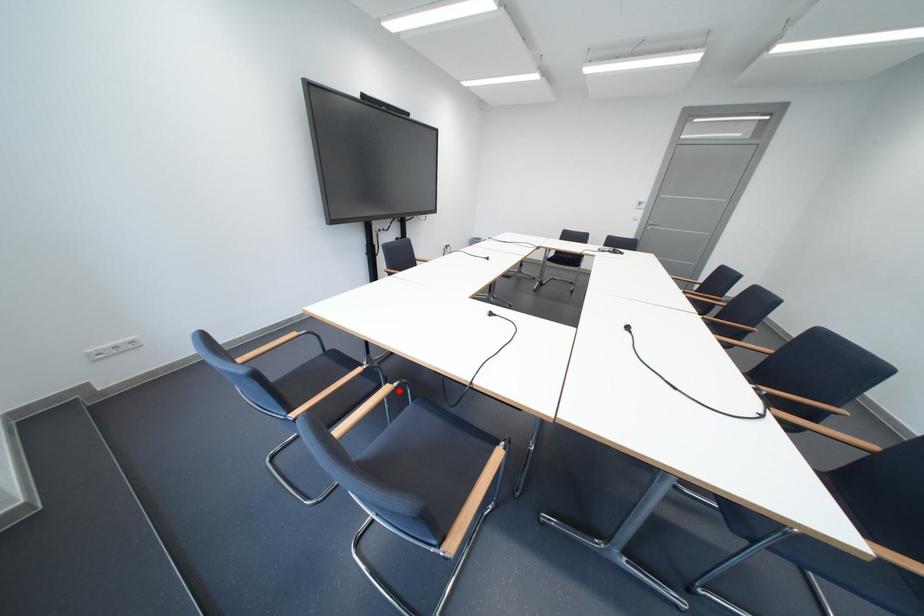
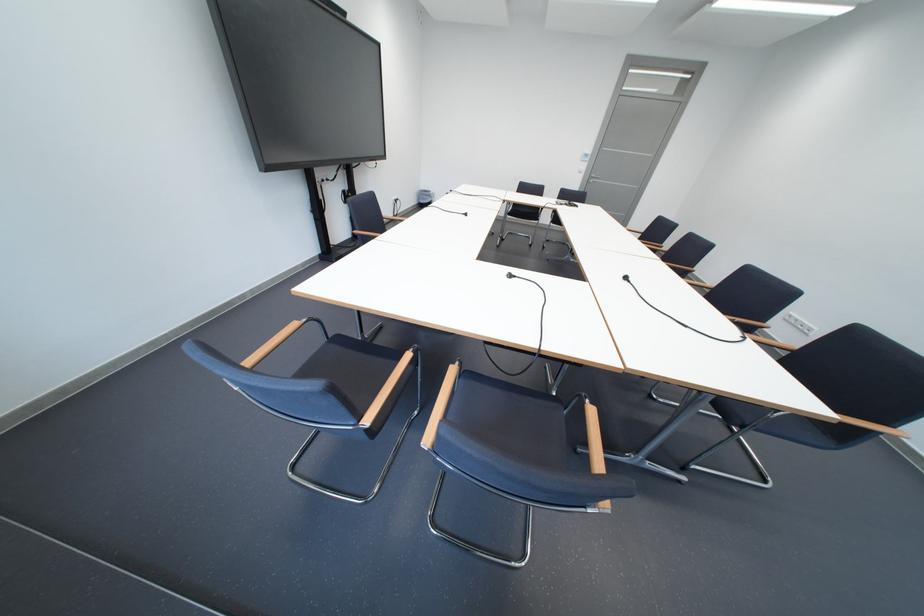
Locate, in the second image, the point that corresponds to the highlighted location in the first image.

(465, 371)